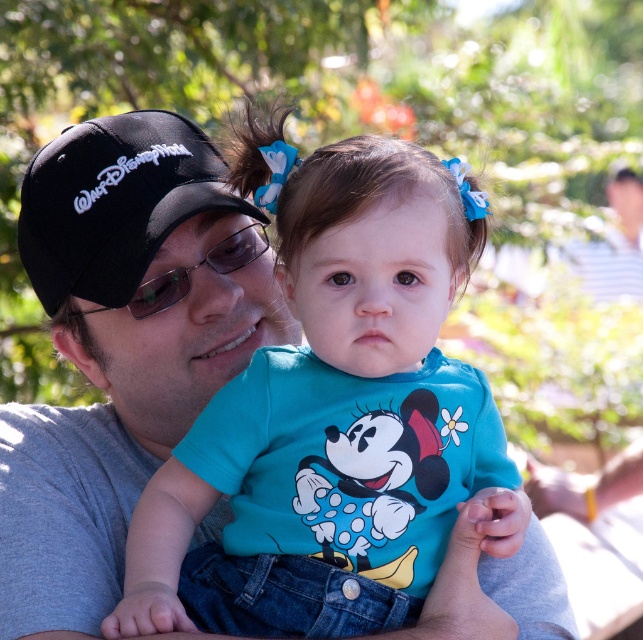
Identify the location of turquoise fabric shirt at center. This screenshot has height=640, width=643. (332, 416).

Which of these two, turquoise fabric shirt at center or sunglasses at center, stands taller?

turquoise fabric shirt at center

Where is `turquoise fabric shirt at center`? The height and width of the screenshot is (640, 643). turquoise fabric shirt at center is located at coordinates (332, 416).

Does black fabric baseball cap at left appear on the right side of sunglasses at center?

No, black fabric baseball cap at left is not to the right of sunglasses at center.

Can you confirm if black fabric baseball cap at left is shorter than sunglasses at center?

No.

Describe the element at coordinates (114, 202) in the screenshot. I see `black fabric baseball cap at left` at that location.

Image resolution: width=643 pixels, height=640 pixels. In order to click on black fabric baseball cap at left in this screenshot , I will do `click(114, 202)`.

The image size is (643, 640). Find the location of `turquoise fabric shirt at center`. turquoise fabric shirt at center is located at coordinates (332, 416).